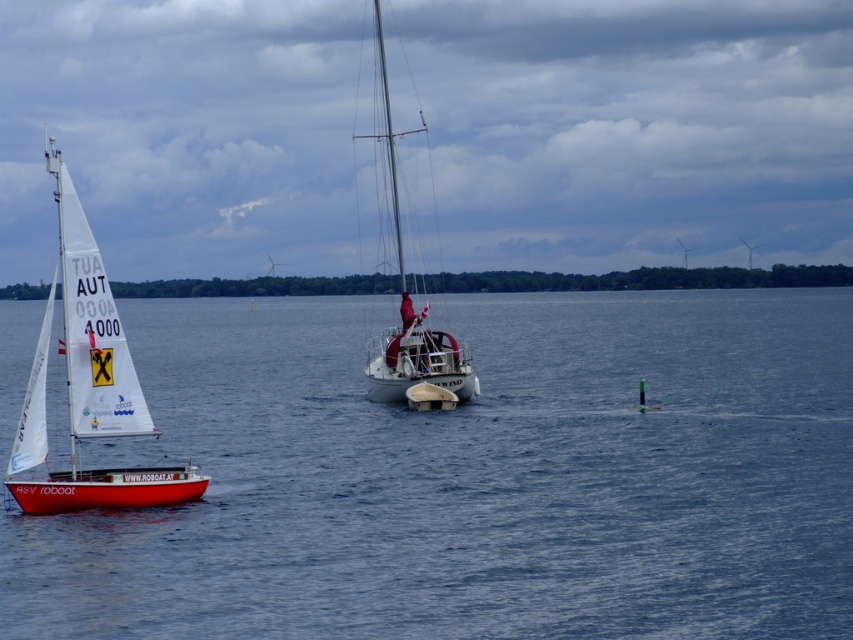
Looking at this image, you are standing on the dock and want to throw a ring to the point marked as point [61,164]. The ring has a diameter of 0.3 meters. Can you estimate if the ring will land within 1 meter of the point?

The point [61,164] is 22.98 meters away from the camera. Since the ring has a diameter of 0.3 meters, the minimum distance required to accurately throw it within 1 meter of the point would need to be calculated. However, based on the given distance, it is likely challenging to achieve such precision from 22.98 meters away. The ring may not land within 1 meter of the point due to the distance involved.

You are standing on the dock and want to board the white sailboat at left and the white glossy sailboat at center. The distance between them is 63.16 feet. If your small rowboat can travel at 2 feet per second, how many seconds will it take to go from one to the other?

The distance between the white sailboat at left and the white glossy sailboat at center is 63.16 feet. At a speed of 2 feet per second, it would take 63.16 divided by 2, which equals 31.58 seconds to travel between them.